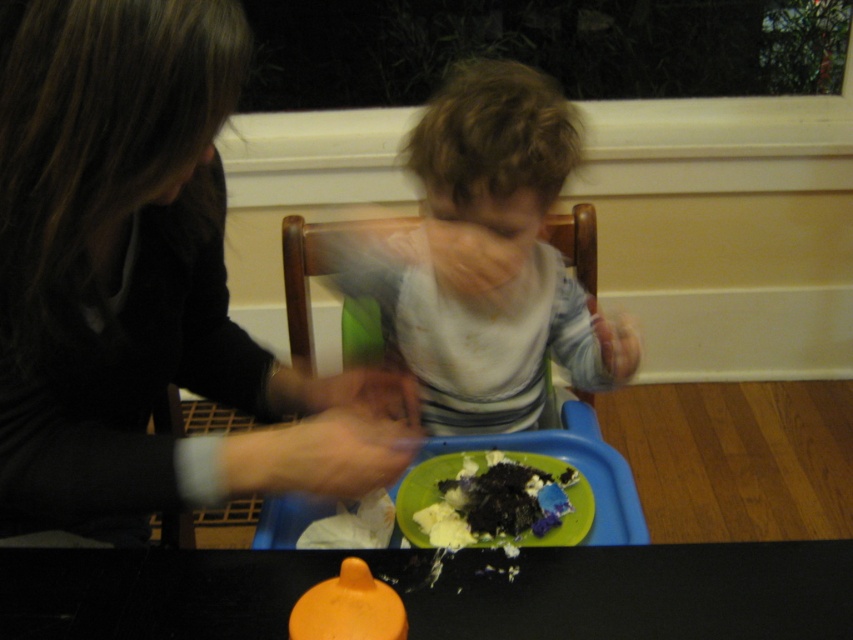
Question: Does black plastic table at lower center appear over dark crumbly cake at lower center?

Choices:
 (A) yes
 (B) no

Answer: (B)

Question: Can you confirm if black plastic table at lower center is bigger than dark crumbly cake at lower center?

Choices:
 (A) yes
 (B) no

Answer: (A)

Question: Which is nearer to the dark crumbly cake at lower center?

Choices:
 (A) black plastic table at lower center
 (B) matte black jacket at upper left
 (C) white striped shirt at center

Answer: (A)

Question: Is matte black jacket at upper left closer to the viewer compared to dark crumbly cake at lower center?

Choices:
 (A) no
 (B) yes

Answer: (B)

Question: Which point is closer to the camera?

Choices:
 (A) white striped shirt at center
 (B) matte black jacket at upper left
 (C) dark crumbly cake at lower center

Answer: (B)

Question: Which object is closer to the camera taking this photo?

Choices:
 (A) dark crumbly cake at lower center
 (B) matte black jacket at upper left
 (C) white striped shirt at center

Answer: (B)